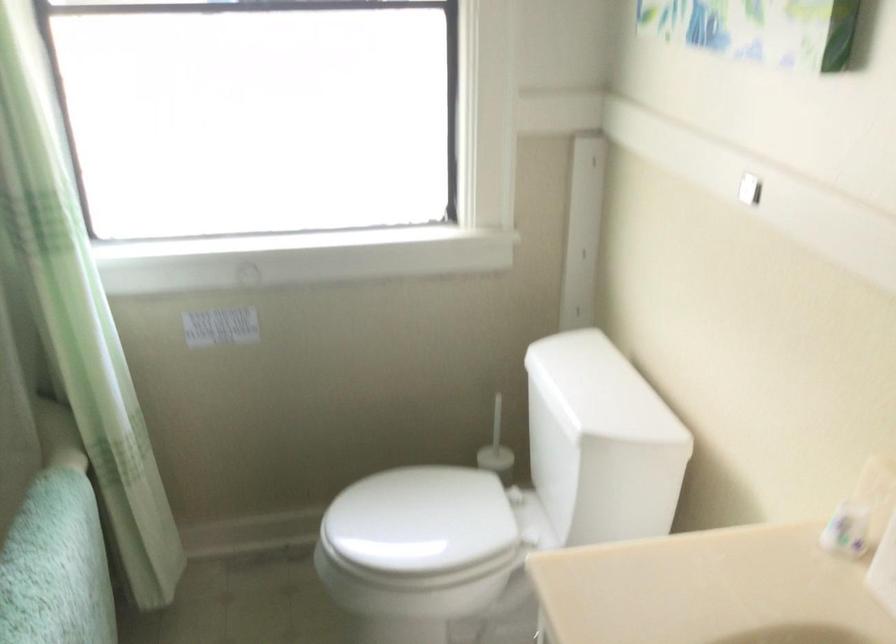
In order to click on light switch in this screenshot , I will do `click(750, 190)`.